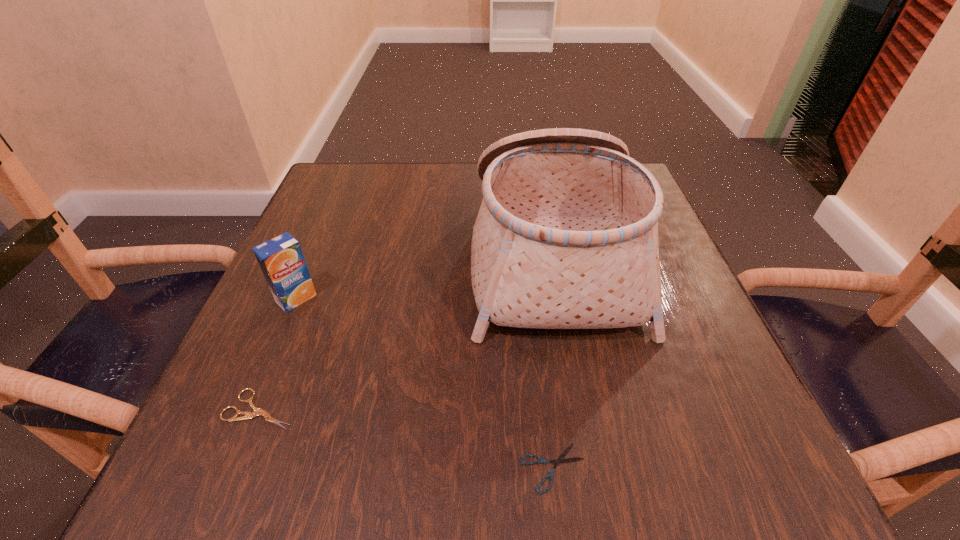
In order to click on free point between the second shortest object and the tallest object in this screenshot , I will do `click(406, 333)`.

You are a GUI agent. You are given a task and a screenshot of the screen. Output one action in this format:
    pyautogui.click(x=<x>, y=<y>)
    Task: Click on the vacant space in between the third farthest object and the right shears
    The image size is (960, 540).
    Given the screenshot: What is the action you would take?
    pos(407,438)

The image size is (960, 540). Identify the location of vacant area between the nearer shears and the basket. (553, 362).

Where is `free space between the second nearest object and the second tallest object`? free space between the second nearest object and the second tallest object is located at coordinates (278, 354).

Locate an element on the screen. This screenshot has width=960, height=540. object that can be found as the third closest to the basket is located at coordinates (281, 260).

This screenshot has width=960, height=540. I want to click on object that is the second closest to the orange_juice, so click(x=566, y=237).

Find the location of a particular element. The width and height of the screenshot is (960, 540). blank area in the image that satisfies the following two spatial constraints: 1. with the lid open on the basket; 2. on the front side of the nearer shears is located at coordinates (591, 468).